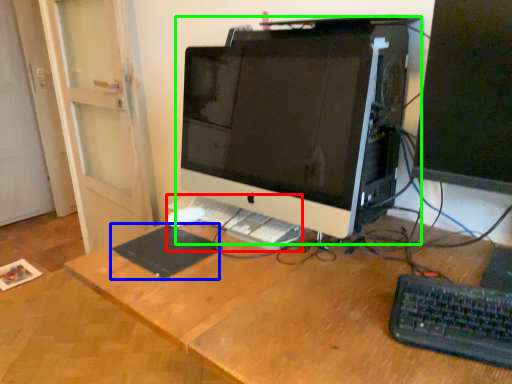
Question: Which object is the closest to the laptop keyboard (highlighted by a red box)? Choose among these: mousepad (highlighted by a blue box) or computer monitor (highlighted by a green box).

Choices:
 (A) mousepad
 (B) computer monitor

Answer: (A)